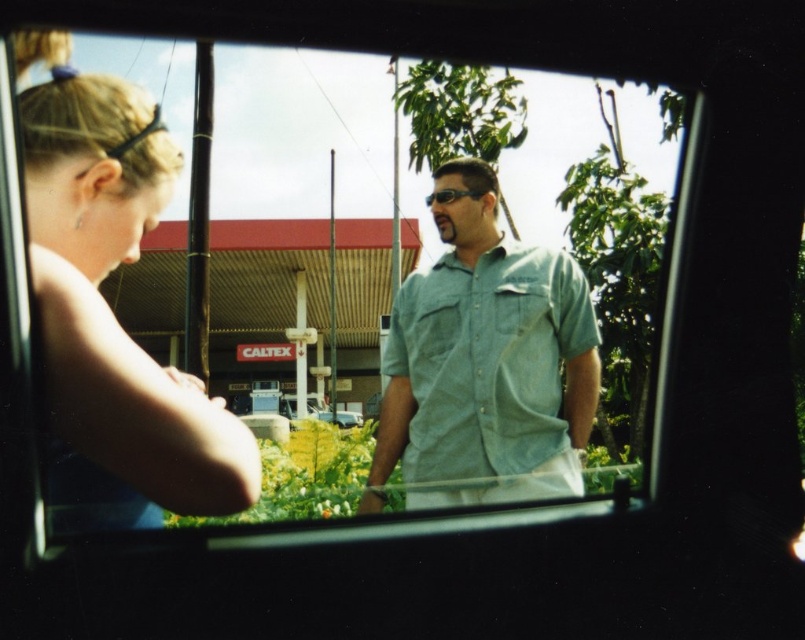
Who is lower down, transparent glass car window at center or matte black sunglasses at center?

Positioned lower is transparent glass car window at center.

Does transparent glass car window at center have a lesser width compared to matte black sunglasses at center?

Incorrect, transparent glass car window at center's width is not less than matte black sunglasses at center's.

Who is more forward, [138,58] or [440,204]?

Positioned in front is point [138,58].

The width and height of the screenshot is (805, 640). What are the coordinates of `transparent glass car window at center` in the screenshot? It's located at (486, 360).

Does point (155, 212) lie in front of point (420, 292)?

Yes, point (155, 212) is closer to viewer.

Is transparent glass car window at center thinner than denim shirt at center?

No.

The width and height of the screenshot is (805, 640). What do you see at coordinates (486, 360) in the screenshot? I see `transparent glass car window at center` at bounding box center [486, 360].

Identify the location of transparent glass car window at center. (486, 360).

Between point (394, 458) and point (473, 192), which one is positioned behind?

Positioned behind is point (394, 458).

Does point (486, 208) lie behind point (451, 198)?

Yes, point (486, 208) is behind point (451, 198).

Who is more forward, (442, 218) or (444, 198)?

Point (442, 218)

Where is `denim shirt at center`? This screenshot has width=805, height=640. denim shirt at center is located at coordinates (484, 353).